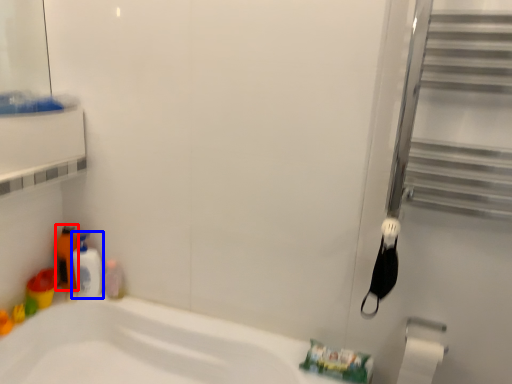
Question: Which of the following is the closest to the observer, toiletry (highlighted by a red box) or cleaning product (highlighted by a blue box)?

Choices:
 (A) toiletry
 (B) cleaning product

Answer: (B)